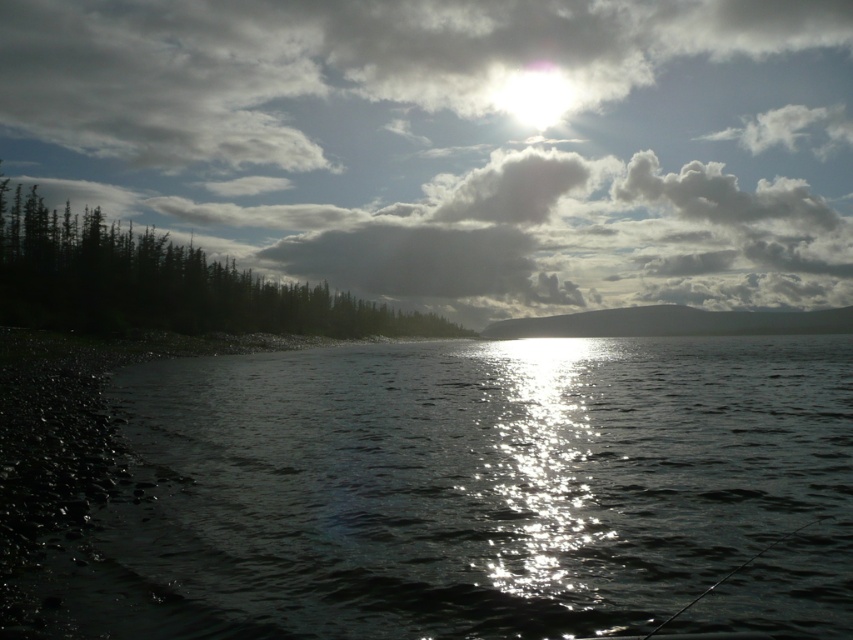
Question: Which point appears closest to the camera in this image?

Choices:
 (A) (772, 545)
 (B) (265, 156)
 (C) (643, 497)

Answer: (A)

Question: Which object is positioned farthest from the glistening water at center?

Choices:
 (A) black rod fishing pole at lower right
 (B) green matte trees at left

Answer: (B)

Question: In this image, where is glistening water at center located relative to black rod fishing pole at lower right?

Choices:
 (A) right
 (B) left

Answer: (A)

Question: Is glistening water at center above cloudy sky at upper center?

Choices:
 (A) yes
 (B) no

Answer: (B)

Question: Does green matte trees at left appear under black rod fishing pole at lower right?

Choices:
 (A) yes
 (B) no

Answer: (B)

Question: Among these objects, which one is farthest from the camera?

Choices:
 (A) black rod fishing pole at lower right
 (B) cloudy sky at upper center
 (C) green matte trees at left
 (D) glistening water at center

Answer: (B)